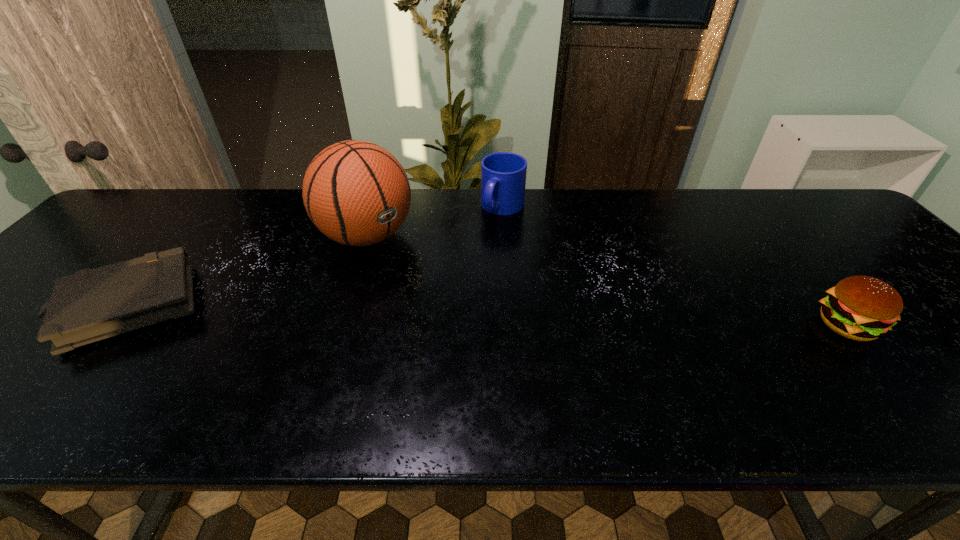
I want to click on free space that satisfies the following two spatial constraints: 1. on the front side of the tallest object; 2. on the left side of the rightmost object, so pos(338,326).